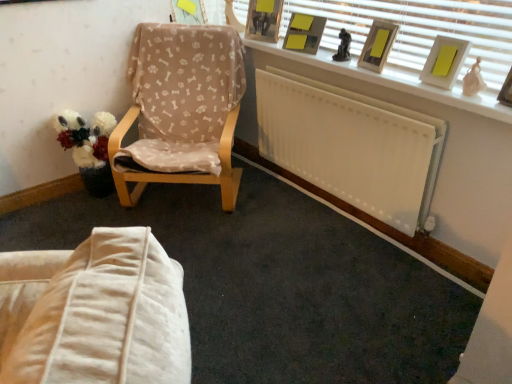
Question: Is point (387, 49) positioned closer to the camera than point (145, 145)?

Choices:
 (A) farther
 (B) closer

Answer: (B)

Question: In terms of width, does matte wooden picture frame at upper right, placed as the 3th picture frame when sorted from front to back, look wider or thinner when compared to beige fabric chair at left?

Choices:
 (A) thin
 (B) wide

Answer: (A)

Question: Which of these objects is positioned farthest from the wooden picture frame at upper center, the fifth picture frame positioned from the right?

Choices:
 (A) matte yellow picture frame at upper center, placed as the first picture frame when sorted from left to right
 (B) yellow matte picture frame at upper center, the 3th picture frame when ordered from left to right
 (C) wooden picture frame at upper right, which is counted as the sixth picture frame, starting from the left
 (D) beige fabric chair at left
 (E) fluffy fabric bouquet at left

Answer: (C)

Question: Which object is the farthest from the white painted wood at upper right?

Choices:
 (A) wooden picture frame at upper right, positioned as the 1th picture frame in right-to-left order
 (B) matte yellow picture frame at upper center, the sixth picture frame when ordered from right to left
 (C) white blinds at upper right
 (D) yellow matte picture frame at upper right, the fifth picture frame positioned from the left
 (E) matte wooden picture frame at upper right, marked as the 4th picture frame in a left-to-right arrangement

Answer: (B)